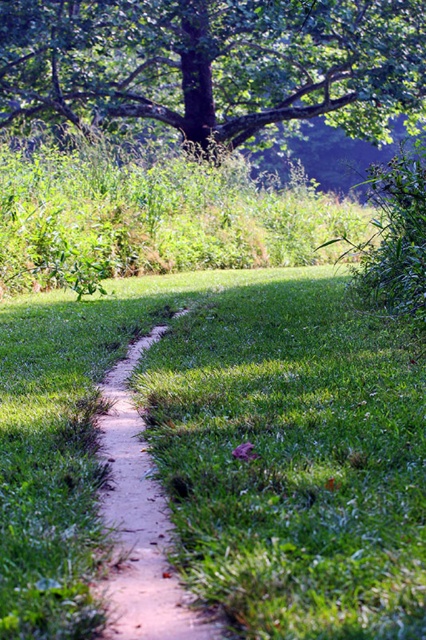
Does point (68, 449) come closer to viewer compared to point (250, 100)?

Yes.

Between green grassy at center and green leafy tree at upper center, which one appears on the left side from the viewer's perspective?

green leafy tree at upper center

I want to click on green grassy at center, so click(224, 452).

Where is `green grassy at center`? This screenshot has height=640, width=426. green grassy at center is located at coordinates (224, 452).